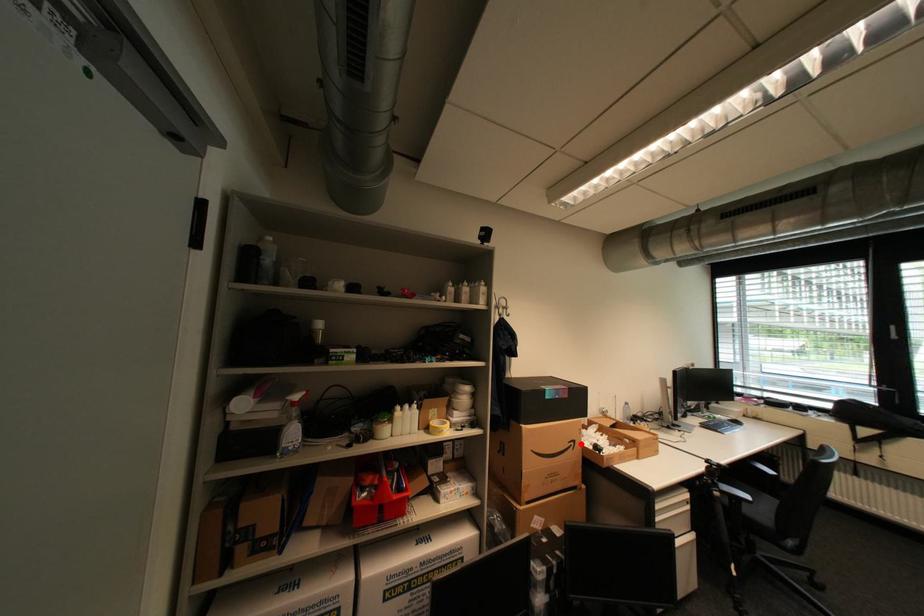
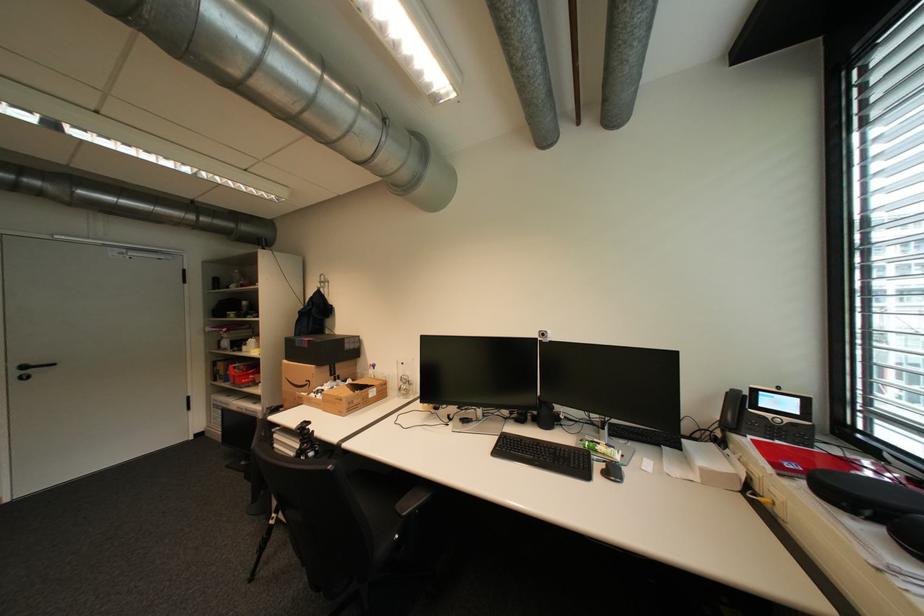
Where in the second image is the point corresponding to the highlighted location from the first image?

(317, 383)